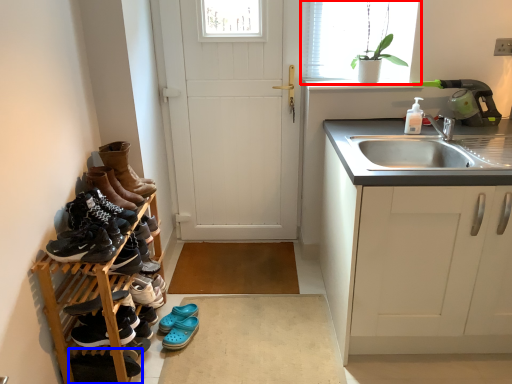
Question: Which of the following is the farthest to the observer, window (highlighted by a red box) or footwear (highlighted by a blue box)?

Choices:
 (A) window
 (B) footwear

Answer: (A)